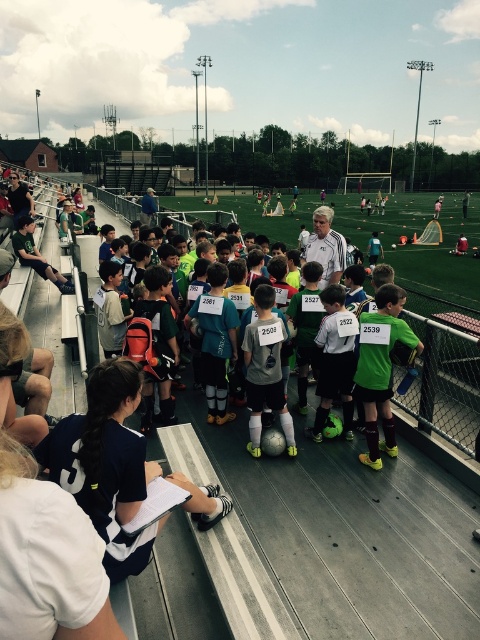
You are a photographer at the soccer event. You need to capture a photo where both the dark blue jersey at lower left and the matte gray jersey at center are clearly visible. Considering their sizes, which jersey should you focus on to ensure both are in frame without zooming in too much?

The dark blue jersey at lower left is larger in size than the matte gray jersey at center, so focusing on the dark blue jersey at lower left would help keep both in frame without excessive zooming.

You are a photographer positioned at the edge of the soccer field. You want to take a photo that includes both the point at coordinates point (387,422) and point (214,312). Which point should you focus on first to ensure both are in focus?

You should focus on point (387,422) first because it is closer to the viewer than point (214,312), ensuring that both points will be in focus when using depth of field appropriately.